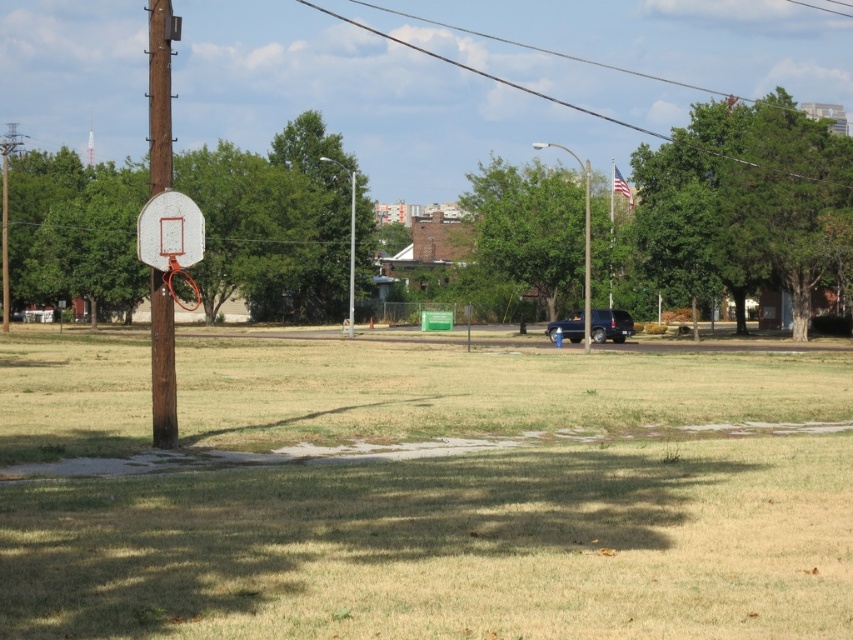
Is dry grass at center smaller than green leafy tree at upper right?

Yes, dry grass at center is smaller than green leafy tree at upper right.

Does dry grass at center appear on the right side of green leafy tree at upper right?

Incorrect, dry grass at center is not on the right side of green leafy tree at upper right.

Which is in front, point (759, 509) or point (692, 276)?

Point (759, 509)

The width and height of the screenshot is (853, 640). I want to click on dry grass at center, so click(457, 502).

Who is lower down, green leafy tree at center or white glossy basketball hoop at left?

white glossy basketball hoop at left

Who is positioned more to the right, green leafy tree at center or white glossy basketball hoop at left?

green leafy tree at center

Locate an element on the screen. green leafy tree at center is located at coordinates (535, 227).

Is green leafy tree at upper right wider than white glossy basketball hoop at left?

No, green leafy tree at upper right is not wider than white glossy basketball hoop at left.

Describe the element at coordinates (744, 202) in the screenshot. The height and width of the screenshot is (640, 853). I see `green leafy tree at upper right` at that location.

Locate an element on the screen. This screenshot has height=640, width=853. green leafy tree at upper right is located at coordinates (744, 202).